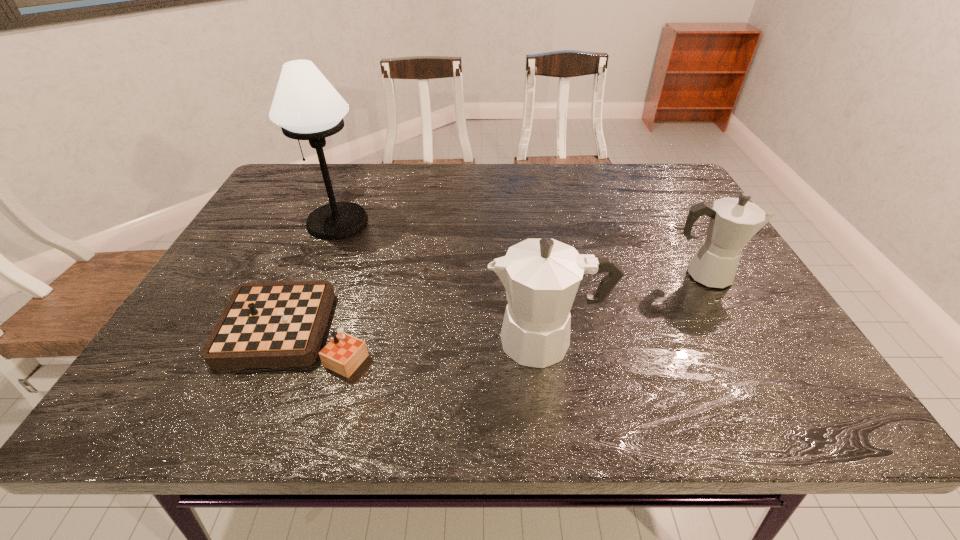
Identify the location of free space between the chessboard and the third nearest object. This screenshot has height=540, width=960. coord(502,303).

This screenshot has width=960, height=540. In order to click on empty space between the third object from left to right and the farthest object in this screenshot , I will do `click(442, 281)`.

This screenshot has height=540, width=960. Find the location of `free space between the third object from left to right and the rightmost object`. free space between the third object from left to right and the rightmost object is located at coordinates (626, 308).

This screenshot has height=540, width=960. Find the location of `the closest object to the second object from right to left`. the closest object to the second object from right to left is located at coordinates (733, 222).

Find the location of a particular element. The image size is (960, 540). the closest object relative to the rightmost object is located at coordinates (541, 276).